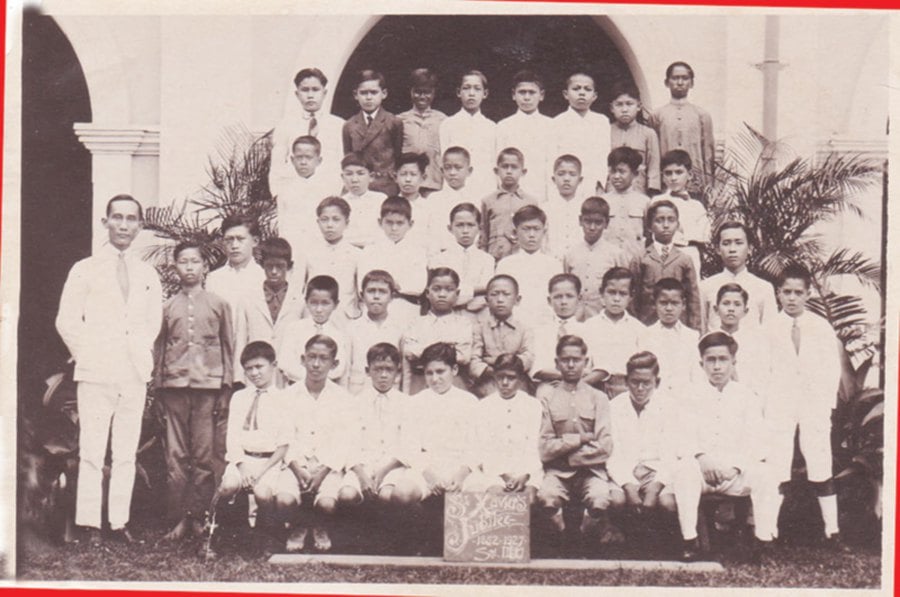
Identify the location of sock. This screenshot has width=900, height=597. (831, 519).